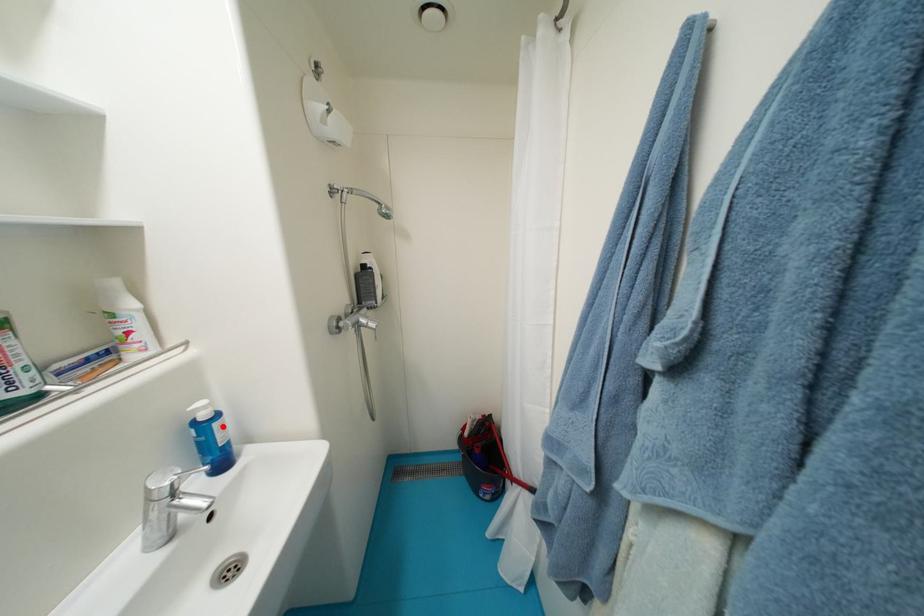
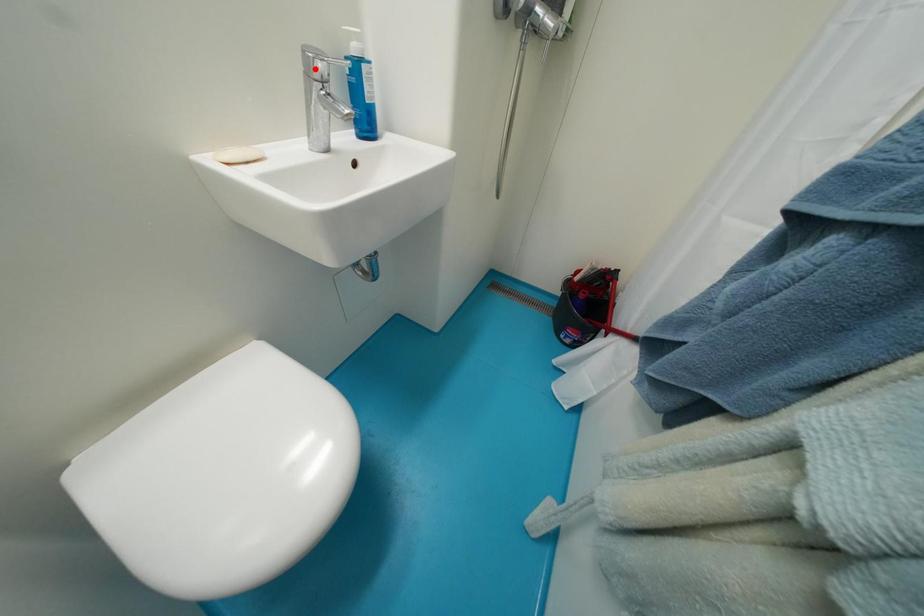
I am providing you with two images of the same scene from different viewpoints. A red point is marked on the first image and another point is marked on the second image. Is the red point in image1 aligned with the point shown in image2?

No